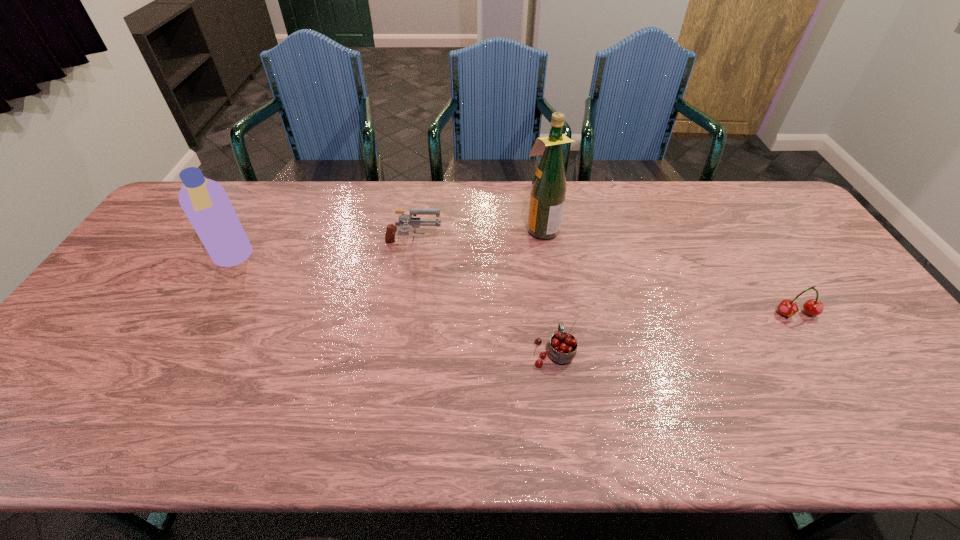
Locate an element on the screen. Image resolution: width=960 pixels, height=540 pixels. vacant space at the far edge of the desktop is located at coordinates (233, 206).

This screenshot has height=540, width=960. In order to click on vacant space at the left edge of the desktop in this screenshot , I will do `click(156, 244)`.

I want to click on vacant space at the right edge of the desktop, so click(778, 241).

In the image, there is a desktop. What are the coordinates of `vacant space at the far right corner` in the screenshot? It's located at (733, 188).

In order to click on free space that is in between the farther cherry and the nearest object in this screenshot , I will do `click(675, 333)`.

The width and height of the screenshot is (960, 540). Identify the location of free point between the second tallest object and the liquor. [387, 244].

This screenshot has height=540, width=960. Find the location of `vacant region between the tallest object and the nearest object`. vacant region between the tallest object and the nearest object is located at coordinates (547, 290).

The image size is (960, 540). Identify the location of free spot between the nearer cherry and the farther cherry. (675, 333).

Locate an element on the screen. free spot between the tallest object and the leftmost object is located at coordinates (387, 244).

The height and width of the screenshot is (540, 960). Find the location of `unoccupied position between the third shortest object and the tallest object`. unoccupied position between the third shortest object and the tallest object is located at coordinates (477, 237).